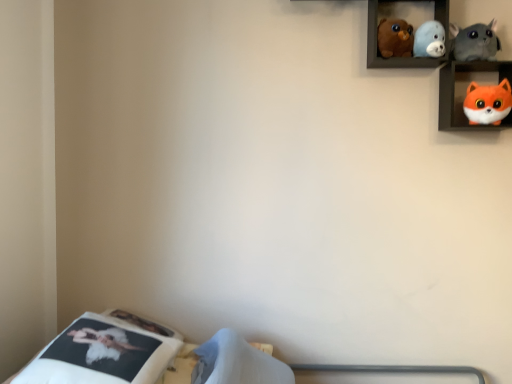
Question: Can you confirm if white fabric mattress at lower left is smaller than orange plush toy at upper right, the 1th shelf in the right-to-left sequence?

Choices:
 (A) no
 (B) yes

Answer: (A)

Question: Does white fabric mattress at lower left turn towards orange plush toy at upper right, which is the second shelf from left to right?

Choices:
 (A) no
 (B) yes

Answer: (A)

Question: Is white fabric mattress at lower left taller than orange plush toy at upper right, which is the second shelf from left to right?

Choices:
 (A) yes
 (B) no

Answer: (A)

Question: Is white fabric mattress at lower left thinner than orange plush toy at upper right, positioned as the 2th shelf in top-to-bottom order?

Choices:
 (A) yes
 (B) no

Answer: (B)

Question: Can you see white fabric mattress at lower left touching orange plush toy at upper right, which is the first shelf from bottom to top?

Choices:
 (A) no
 (B) yes

Answer: (A)

Question: From the image's perspective, would you say white fabric mattress at lower left is shown under orange plush toy at upper right, positioned as the 2th shelf in top-to-bottom order?

Choices:
 (A) yes
 (B) no

Answer: (A)

Question: From a real-world perspective, is fluffy orange plush at upper right, which is counted as the first toy, starting from the right, below soft plush seal at upper center, positioned as the third toy in right-to-left order?

Choices:
 (A) no
 (B) yes

Answer: (B)

Question: Is fluffy orange plush at upper right, which is counted as the first toy, starting from the right, bigger than soft plush seal at upper center, positioned as the third toy in right-to-left order?

Choices:
 (A) no
 (B) yes

Answer: (B)

Question: Could you tell me if fluffy orange plush at upper right, which is the 4th toy from left to right, is facing soft plush seal at upper center, positioned as the third toy in right-to-left order?

Choices:
 (A) yes
 (B) no

Answer: (B)

Question: Considering the relative sizes of fluffy orange plush at upper right, which is counted as the first toy, starting from the right, and soft plush seal at upper center, which is the second toy from left to right, in the image provided, is fluffy orange plush at upper right, which is counted as the first toy, starting from the right, wider than soft plush seal at upper center, which is the second toy from left to right,?

Choices:
 (A) no
 (B) yes

Answer: (A)

Question: Does fluffy orange plush at upper right, which is the 4th toy from left to right, appear on the right side of soft plush seal at upper center, which is the second toy from left to right?

Choices:
 (A) yes
 (B) no

Answer: (A)

Question: From the image's perspective, is fluffy orange plush at upper right, which is counted as the first toy, starting from the right, under soft plush seal at upper center, which is the second toy from left to right?

Choices:
 (A) no
 (B) yes

Answer: (B)

Question: From a real-world perspective, is orange plush toy at upper right, positioned as the 2th shelf in top-to-bottom order, positioned under fluffy gray cat at upper right, positioned as the second toy in right-to-left order, based on gravity?

Choices:
 (A) no
 (B) yes

Answer: (B)